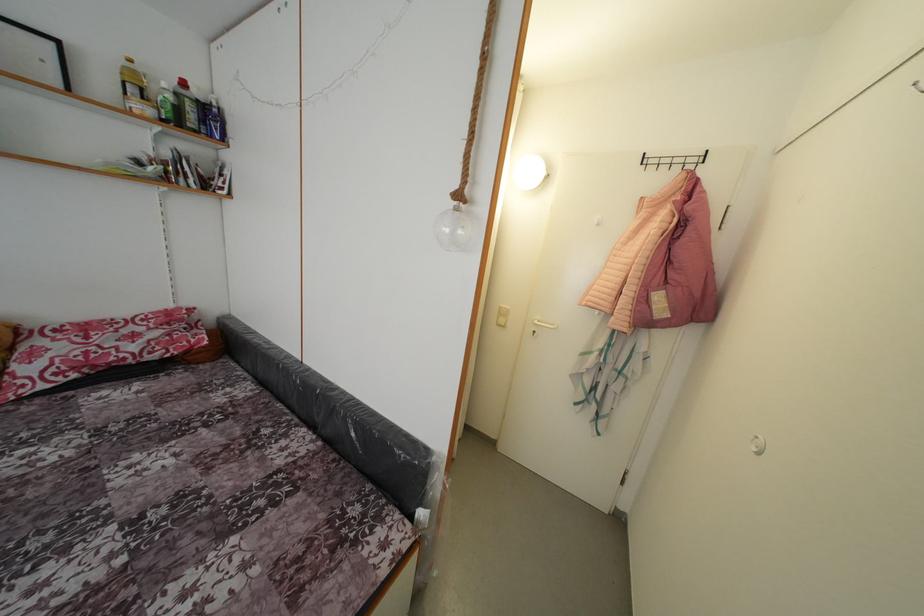
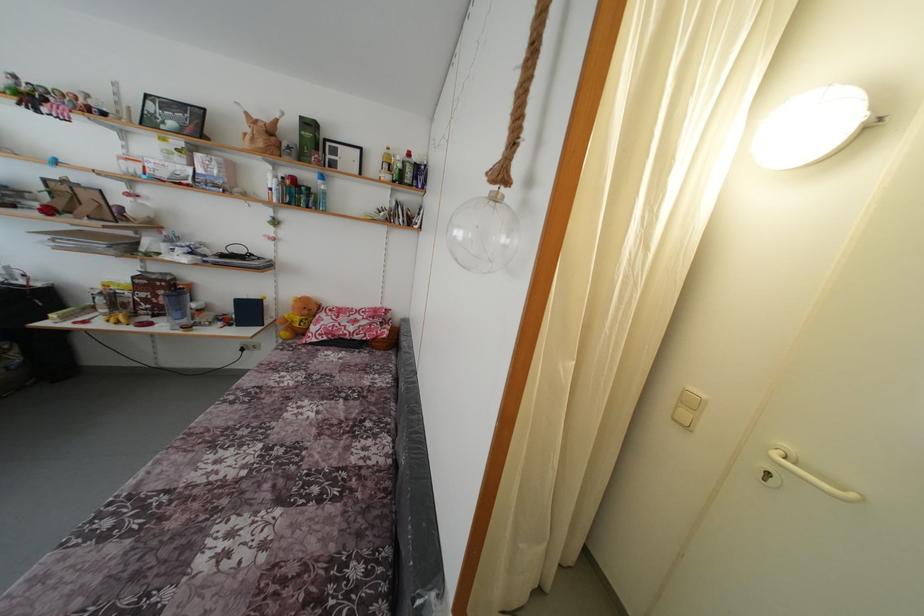
The point at (462, 215) is marked in the first image. Where is the corresponding point in the second image?

(500, 204)